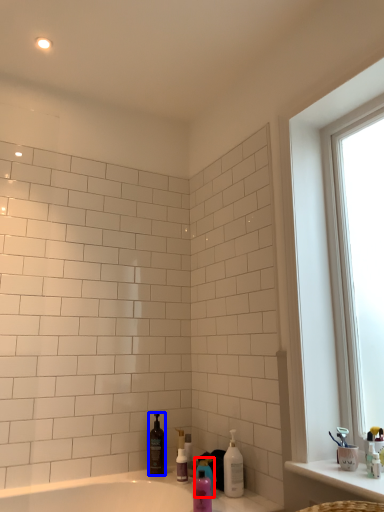
Question: Which of the following is the farthest to the observer, cleaning product (highlighted by a red box) or cleaning product (highlighted by a blue box)?

Choices:
 (A) cleaning product
 (B) cleaning product

Answer: (B)